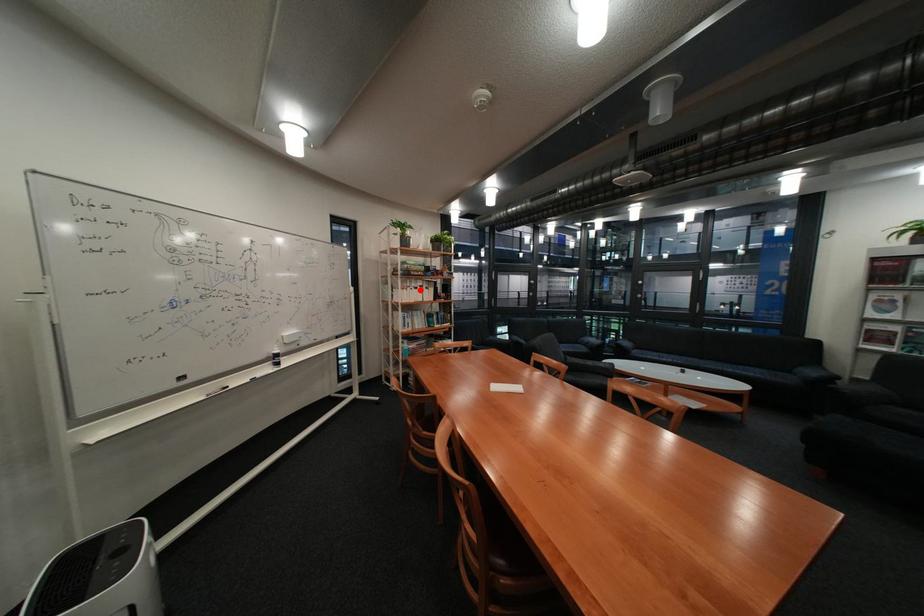
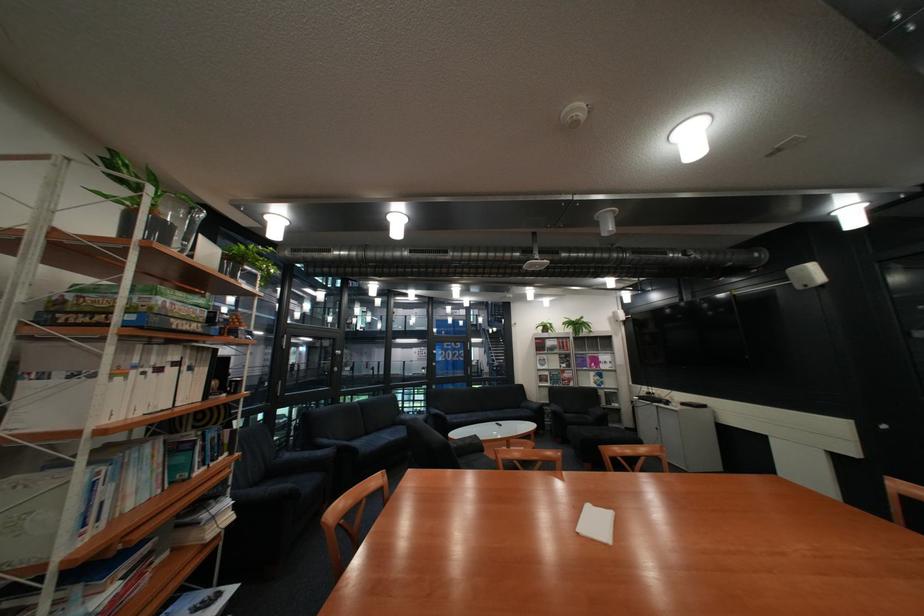
Find the pixel in the second image that matches the highlighted location in the first image.

(134, 379)